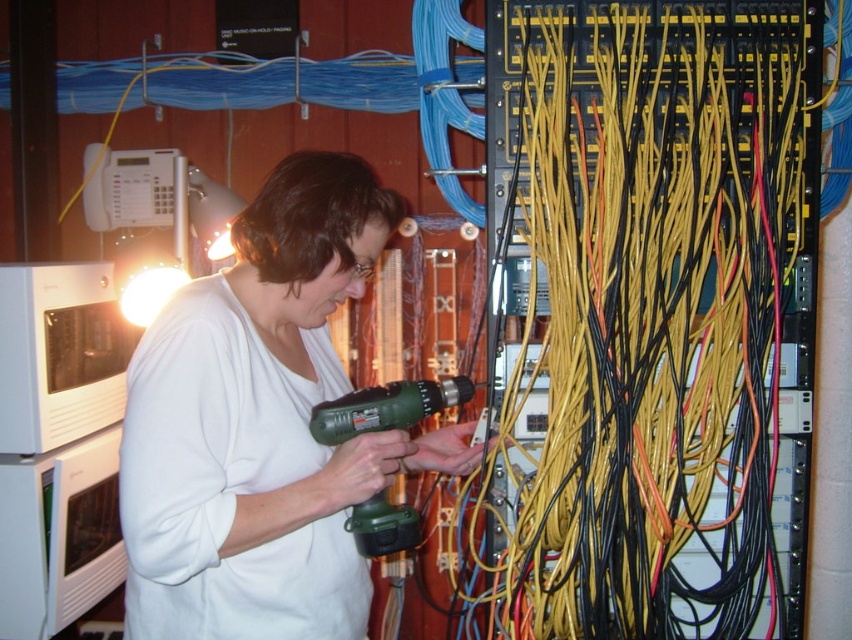
Question: Is white matte shirt at center closer to camera compared to green plastic drill at center?

Choices:
 (A) yes
 (B) no

Answer: (A)

Question: Which object is farther from the camera taking this photo?

Choices:
 (A) green plastic drill at center
 (B) white matte shirt at center

Answer: (A)

Question: Can you confirm if white matte shirt at center is positioned to the right of green plastic drill at center?

Choices:
 (A) no
 (B) yes

Answer: (A)

Question: Which point is closer to the camera?

Choices:
 (A) (383, 240)
 (B) (417, 401)

Answer: (B)

Question: Among these points, which one is farthest from the camera?

Choices:
 (A) (394, 513)
 (B) (209, 570)

Answer: (A)

Question: Is the position of white matte shirt at center more distant than that of green plastic drill at center?

Choices:
 (A) no
 (B) yes

Answer: (A)